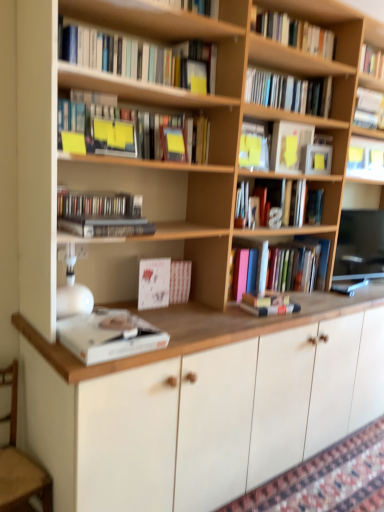
I want to click on free space above white matte book at lower left, positioned as the 1th book in bottom-to-top order (from a real-world perspective), so click(x=108, y=324).